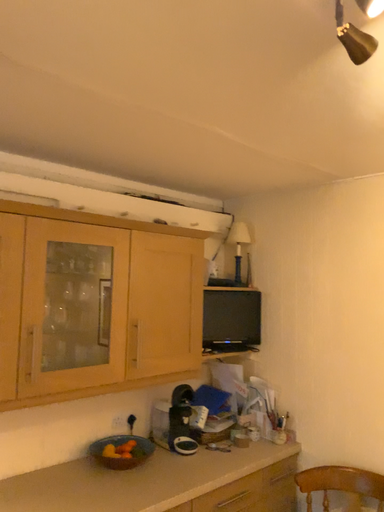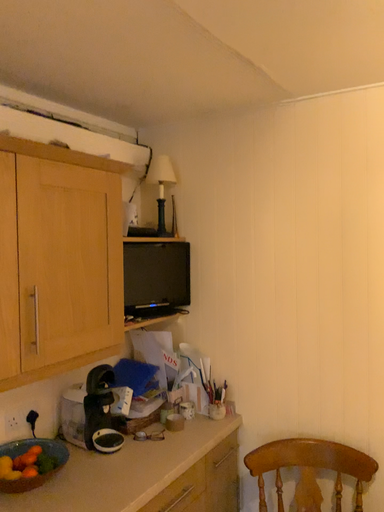
Question: How did the camera likely rotate when shooting the video?

Choices:
 (A) rotated right
 (B) rotated left

Answer: (A)